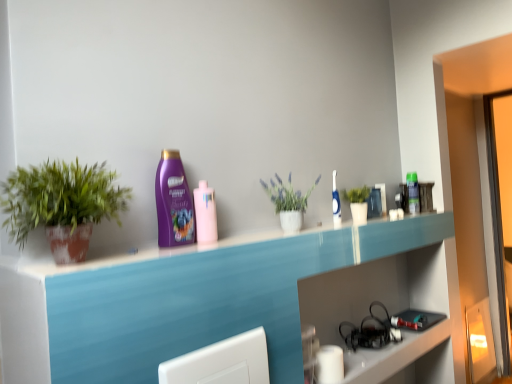
This screenshot has height=384, width=512. Find the location of `white glossy toothbrush at upper center, which is the second mouthwash in back-to-front order`. white glossy toothbrush at upper center, which is the second mouthwash in back-to-front order is located at coordinates (336, 202).

The width and height of the screenshot is (512, 384). What do you see at coordinates (173, 202) in the screenshot?
I see `purple glossy shampoo at center` at bounding box center [173, 202].

Locate an element on the screen. The image size is (512, 384). green plastic bottle at upper right, arranged as the first mouthwash when viewed from the right is located at coordinates (413, 193).

What do you see at coordinates (413, 193) in the screenshot? The image size is (512, 384). I see `green plastic bottle at upper right, which is the 1th mouthwash in back-to-front order` at bounding box center [413, 193].

Where is `pink glossy mouthwash at center, placed as the 1th mouthwash when sorted from left to right`? This screenshot has height=384, width=512. pink glossy mouthwash at center, placed as the 1th mouthwash when sorted from left to right is located at coordinates (205, 214).

At what (x,y) coordinates should I click in order to perform the action: click on green matte plant at upper right, which is the 1th houseplant in back-to-front order. Please return your answer as a coordinate pair (x, y). This screenshot has height=384, width=512. Looking at the image, I should click on [357, 203].

Where is `white glossy toothbrush at upper center, positioned as the 2th mouthwash in left-to-right order`? The width and height of the screenshot is (512, 384). white glossy toothbrush at upper center, positioned as the 2th mouthwash in left-to-right order is located at coordinates (336, 202).

Based on the photo, from the image's perspective, is purple glossy shampoo at center above or below green plastic bottle at upper right, the third mouthwash viewed from the front?

Based on their image positions, purple glossy shampoo at center is located beneath green plastic bottle at upper right, the third mouthwash viewed from the front.

From their relative heights in the image, would you say purple glossy shampoo at center is taller or shorter than green plastic bottle at upper right, which is the 1th mouthwash in back-to-front order?

purple glossy shampoo at center is taller than green plastic bottle at upper right, which is the 1th mouthwash in back-to-front order.

Would you say purple glossy shampoo at center is a long distance from green plastic bottle at upper right, the third mouthwash viewed from the front?

purple glossy shampoo at center is positioned a significant distance from green plastic bottle at upper right, the third mouthwash viewed from the front.

You are a GUI agent. You are given a task and a screenshot of the screen. Output one action in this format:
    pyautogui.click(x=<x>, y=<y>)
    Task: Click on the cleaning product above the green plastic bottle at upper right, the third mouthwash viewed from the front (from a real-world perspective)
    This screenshot has height=384, width=512.
    Given the screenshot: What is the action you would take?
    pyautogui.click(x=173, y=202)

In the image, is white matte vase at center, the 2th houseplant viewed from the front, on the left side or the right side of green matte plant at upper right, placed as the 1th houseplant when sorted from right to left?

white matte vase at center, the 2th houseplant viewed from the front, is to the left of green matte plant at upper right, placed as the 1th houseplant when sorted from right to left.

Does white matte vase at center, which is the second houseplant from back to front, have a greater width compared to green matte plant at upper right, which is the 1th houseplant in back-to-front order?

Yes, white matte vase at center, which is the second houseplant from back to front, is wider than green matte plant at upper right, which is the 1th houseplant in back-to-front order.

Based on the photo, from a real-world perspective, is white matte vase at center, positioned as the 2th houseplant in right-to-left order, positioned above or below green matte plant at upper right, which is counted as the 3th houseplant, starting from the left?

white matte vase at center, positioned as the 2th houseplant in right-to-left order, is situated higher than green matte plant at upper right, which is counted as the 3th houseplant, starting from the left, in the real world.

How many degrees apart are the facing directions of white matte vase at center, positioned as the 2th houseplant in right-to-left order, and green matte plant at upper right, which is the 1th houseplant in back-to-front order?

There is a 2.95-degree angle between the facing directions of white matte vase at center, positioned as the 2th houseplant in right-to-left order, and green matte plant at upper right, which is the 1th houseplant in back-to-front order.

Is green matte plant at left, arranged as the first houseplant when viewed from the left, at the right side of white glossy toothbrush at upper center, positioned as the 2th mouthwash in right-to-left order?

No, green matte plant at left, arranged as the first houseplant when viewed from the left, is not to the right of white glossy toothbrush at upper center, positioned as the 2th mouthwash in right-to-left order.

Based on the photo, is green matte plant at left, arranged as the 3th houseplant when viewed from the right, facing towards white glossy toothbrush at upper center, positioned as the 2th mouthwash in left-to-right order?

No, green matte plant at left, arranged as the 3th houseplant when viewed from the right, is not aimed at white glossy toothbrush at upper center, positioned as the 2th mouthwash in left-to-right order.

Is there a large distance between green matte plant at left, arranged as the 3th houseplant when viewed from the right, and white glossy toothbrush at upper center, which is the second mouthwash in back-to-front order?

Yes, green matte plant at left, arranged as the 3th houseplant when viewed from the right, and white glossy toothbrush at upper center, which is the second mouthwash in back-to-front order, are located far from each other.

Is green matte plant at left, acting as the first houseplant starting from the front, bigger or smaller than white glossy toothbrush at upper center, positioned as the 2th mouthwash in left-to-right order?

Clearly, green matte plant at left, acting as the first houseplant starting from the front, is larger in size than white glossy toothbrush at upper center, positioned as the 2th mouthwash in left-to-right order.

From a real-world perspective, is green matte plant at upper right, placed as the 1th houseplant when sorted from right to left, on top of purple glossy shampoo at center?

Incorrect, from a real-world perspective, green matte plant at upper right, placed as the 1th houseplant when sorted from right to left, is lower than purple glossy shampoo at center.

Between green matte plant at upper right, which is the 1th houseplant in back-to-front order, and purple glossy shampoo at center, which one has more height?

With more height is purple glossy shampoo at center.

Where is `cleaning product above the green matte plant at upper right, which is counted as the 3th houseplant, starting from the left (from a real-world perspective)`? Image resolution: width=512 pixels, height=384 pixels. cleaning product above the green matte plant at upper right, which is counted as the 3th houseplant, starting from the left (from a real-world perspective) is located at coordinates click(x=173, y=202).

What's the angular difference between green matte plant at upper right, which is counted as the 3th houseplant, starting from the left, and purple glossy shampoo at center's facing directions?

The facing directions of green matte plant at upper right, which is counted as the 3th houseplant, starting from the left, and purple glossy shampoo at center are 4.82 degrees apart.

Measure the distance between purple glossy shampoo at center and green matte plant at left, the 3th houseplant in the back-to-front sequence.

22.89 centimeters.

From a real-world perspective, which houseplant is the 1st one underneath the purple glossy shampoo at center? Please provide its 2D coordinates.

[(61, 205)]

From the image's perspective, which object appears higher, purple glossy shampoo at center or green matte plant at left, arranged as the first houseplant when viewed from the left?

From the image's view, purple glossy shampoo at center is above.

Can you confirm if purple glossy shampoo at center is bigger than green matte plant at left, arranged as the first houseplant when viewed from the left?

No, purple glossy shampoo at center is not bigger than green matte plant at left, arranged as the first houseplant when viewed from the left.

From the image's perspective, is green plastic bottle at upper right, which is the 1th mouthwash in back-to-front order, located beneath pink glossy mouthwash at center, placed as the 1th mouthwash when sorted from left to right?

No.

Is green plastic bottle at upper right, which is the 1th mouthwash in back-to-front order, next to pink glossy mouthwash at center, positioned as the first mouthwash in front-to-back order, and touching it?

There is a gap between green plastic bottle at upper right, which is the 1th mouthwash in back-to-front order, and pink glossy mouthwash at center, positioned as the first mouthwash in front-to-back order.

Where is `the 2nd mouthwash counting from the right of the pink glossy mouthwash at center, which is counted as the third mouthwash, starting from the right`? the 2nd mouthwash counting from the right of the pink glossy mouthwash at center, which is counted as the third mouthwash, starting from the right is located at coordinates (413, 193).

Is green plastic bottle at upper right, arranged as the first mouthwash when viewed from the right, aimed at pink glossy mouthwash at center, placed as the 1th mouthwash when sorted from left to right?

No, green plastic bottle at upper right, arranged as the first mouthwash when viewed from the right, is not aimed at pink glossy mouthwash at center, placed as the 1th mouthwash when sorted from left to right.

Between pink glossy mouthwash at center, placed as the 1th mouthwash when sorted from left to right, and purple glossy shampoo at center, which one has larger width?

With larger width is pink glossy mouthwash at center, placed as the 1th mouthwash when sorted from left to right.

Based on the photo, does pink glossy mouthwash at center, placed as the 1th mouthwash when sorted from left to right, come behind purple glossy shampoo at center?

That is True.

Who is shorter, pink glossy mouthwash at center, the third mouthwash from the back, or purple glossy shampoo at center?

pink glossy mouthwash at center, the third mouthwash from the back.

I want to click on cleaning product on the left side of green plastic bottle at upper right, acting as the 3th mouthwash starting from the left, so click(173, 202).

From the image's perspective, which houseplant is the 2nd one below the white matte vase at center, the 2th houseplant viewed from the front? Please provide its 2D coordinates.

[(357, 203)]

Looking at this image, based on their spatial positions, is green matte plant at upper right, marked as the 3th houseplant in a front-to-back arrangement, or green plastic bottle at upper right, arranged as the first mouthwash when viewed from the right, closer to pink glossy mouthwash at center, which is counted as the third mouthwash, starting from the right?

green matte plant at upper right, marked as the 3th houseplant in a front-to-back arrangement, lies closer to pink glossy mouthwash at center, which is counted as the third mouthwash, starting from the right, than the other object.

Estimate the real-world distances between objects in this image. Which object is closer to purple glossy shampoo at center, white matte vase at center, the 2th houseplant viewed from the front, or green matte plant at left, acting as the first houseplant starting from the front?

The object closer to purple glossy shampoo at center is green matte plant at left, acting as the first houseplant starting from the front.

Estimate the real-world distances between objects in this image. Which object is further from green matte plant at left, arranged as the 3th houseplant when viewed from the right, green matte plant at upper right, which is counted as the 3th houseplant, starting from the left, or white matte vase at center, the second houseplant viewed from the left?

Among the two, green matte plant at upper right, which is counted as the 3th houseplant, starting from the left, is located further to green matte plant at left, arranged as the 3th houseplant when viewed from the right.

From the image, which object appears to be farther from white glossy toothbrush at upper center, positioned as the 2th mouthwash in right-to-left order, green matte plant at left, arranged as the 3th houseplant when viewed from the right, or pink glossy mouthwash at center, positioned as the first mouthwash in front-to-back order?

Based on the image, green matte plant at left, arranged as the 3th houseplant when viewed from the right, appears to be further to white glossy toothbrush at upper center, positioned as the 2th mouthwash in right-to-left order.

Which object lies nearer to the anchor point green plastic bottle at upper right, which is the 1th mouthwash in back-to-front order, white matte vase at center, the second houseplant viewed from the left, or pink glossy mouthwash at center, the third mouthwash from the back?

white matte vase at center, the second houseplant viewed from the left, is positioned closer to the anchor green plastic bottle at upper right, which is the 1th mouthwash in back-to-front order.

When comparing their distances from green matte plant at upper right, which is the 1th houseplant in back-to-front order, does white glossy toothbrush at upper center, which is the second mouthwash in back-to-front order, or pink glossy mouthwash at center, placed as the 1th mouthwash when sorted from left to right, seem further?

Based on the image, pink glossy mouthwash at center, placed as the 1th mouthwash when sorted from left to right, appears to be further to green matte plant at upper right, which is the 1th houseplant in back-to-front order.

When comparing their distances from pink glossy mouthwash at center, which is counted as the third mouthwash, starting from the right, does purple glossy shampoo at center or green matte plant at upper right, marked as the 3th houseplant in a front-to-back arrangement, seem further?

green matte plant at upper right, marked as the 3th houseplant in a front-to-back arrangement, is positioned further to the anchor pink glossy mouthwash at center, which is counted as the third mouthwash, starting from the right.

When comparing their distances from green plastic bottle at upper right, which is the 1th mouthwash in back-to-front order, does pink glossy mouthwash at center, positioned as the first mouthwash in front-to-back order, or green matte plant at upper right, marked as the 3th houseplant in a front-to-back arrangement, seem closer?

green matte plant at upper right, marked as the 3th houseplant in a front-to-back arrangement, is closer to green plastic bottle at upper right, which is the 1th mouthwash in back-to-front order.

Locate an element on the screen. houseplant between white glossy toothbrush at upper center, positioned as the 2th mouthwash in left-to-right order, and green plastic bottle at upper right, which is the 1th mouthwash in back-to-front order is located at coordinates (357, 203).

The height and width of the screenshot is (384, 512). I want to click on houseplant between pink glossy mouthwash at center, which is counted as the third mouthwash, starting from the right, and green matte plant at upper right, which is the 1th houseplant in back-to-front order, in the horizontal direction, so click(x=288, y=202).

Locate an element on the screen. This screenshot has height=384, width=512. houseplant between white matte vase at center, the second houseplant viewed from the left, and green plastic bottle at upper right, which is the 1th mouthwash in back-to-front order, along the z-axis is located at coordinates (357, 203).

Find the location of `houseplant situated between purple glossy shampoo at center and white glossy toothbrush at upper center, positioned as the 2th mouthwash in left-to-right order, from left to right`. houseplant situated between purple glossy shampoo at center and white glossy toothbrush at upper center, positioned as the 2th mouthwash in left-to-right order, from left to right is located at coordinates (288, 202).